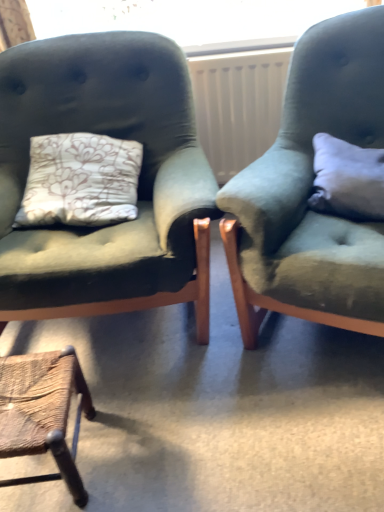
Question: Should I look upward or downward to see white plastic radiator at center?

Choices:
 (A) up
 (B) down

Answer: (A)

Question: Does rustic wood stool at lower left, the third chair in the right-to-left sequence, contain velvet green armchair at left, which is counted as the second chair, starting from the left?

Choices:
 (A) yes
 (B) no

Answer: (B)

Question: Is rustic wood stool at lower left, the 1th chair in the left-to-right sequence, thinner than velvet green armchair at left, placed as the second chair when sorted from right to left?

Choices:
 (A) yes
 (B) no

Answer: (A)

Question: Considering the relative positions of rustic wood stool at lower left, the third chair in the right-to-left sequence, and velvet green armchair at left, placed as the second chair when sorted from right to left, in the image provided, is rustic wood stool at lower left, the third chair in the right-to-left sequence, behind velvet green armchair at left, placed as the second chair when sorted from right to left,?

Choices:
 (A) no
 (B) yes

Answer: (B)

Question: From a real-world perspective, is rustic wood stool at lower left, the 1th chair in the left-to-right sequence, under velvet green armchair at left, which is counted as the second chair, starting from the left?

Choices:
 (A) yes
 (B) no

Answer: (A)

Question: Does rustic wood stool at lower left, the 1th chair in the left-to-right sequence, have a lesser height compared to velvet green armchair at left, placed as the second chair when sorted from right to left?

Choices:
 (A) yes
 (B) no

Answer: (A)

Question: From the image's perspective, is rustic wood stool at lower left, the 1th chair in the left-to-right sequence, over velvet green armchair at left, placed as the second chair when sorted from right to left?

Choices:
 (A) no
 (B) yes

Answer: (A)

Question: Can you confirm if velvet green armchair at left, which is counted as the second chair, starting from the left, is smaller than velvet green armchair at right, marked as the first chair in a right-to-left arrangement?

Choices:
 (A) yes
 (B) no

Answer: (B)

Question: Is the depth of velvet green armchair at left, placed as the second chair when sorted from right to left, less than that of velvet green armchair at right, marked as the third chair in a left-to-right arrangement?

Choices:
 (A) yes
 (B) no

Answer: (B)

Question: Considering the relative sizes of velvet green armchair at left, which is counted as the second chair, starting from the left, and velvet green armchair at right, marked as the first chair in a right-to-left arrangement, in the image provided, is velvet green armchair at left, which is counted as the second chair, starting from the left, shorter than velvet green armchair at right, marked as the first chair in a right-to-left arrangement,?

Choices:
 (A) yes
 (B) no

Answer: (A)

Question: Can you confirm if velvet green armchair at left, which is counted as the second chair, starting from the left, is positioned to the right of velvet green armchair at right, marked as the first chair in a right-to-left arrangement?

Choices:
 (A) no
 (B) yes

Answer: (A)

Question: Is velvet green armchair at left, which is counted as the second chair, starting from the left, positioned beyond the bounds of velvet green armchair at right, marked as the first chair in a right-to-left arrangement?

Choices:
 (A) yes
 (B) no

Answer: (A)

Question: Is velvet green armchair at left, which is counted as the second chair, starting from the left, with velvet green armchair at right, marked as the first chair in a right-to-left arrangement?

Choices:
 (A) yes
 (B) no

Answer: (B)

Question: Can you confirm if white plastic radiator at center is thinner than velvet green armchair at left, which is counted as the second chair, starting from the left?

Choices:
 (A) yes
 (B) no

Answer: (A)